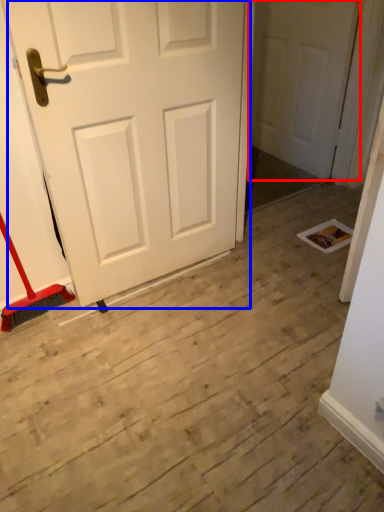
Question: Which object is closer to the camera taking this photo, door (highlighted by a red box) or door (highlighted by a blue box)?

Choices:
 (A) door
 (B) door

Answer: (B)